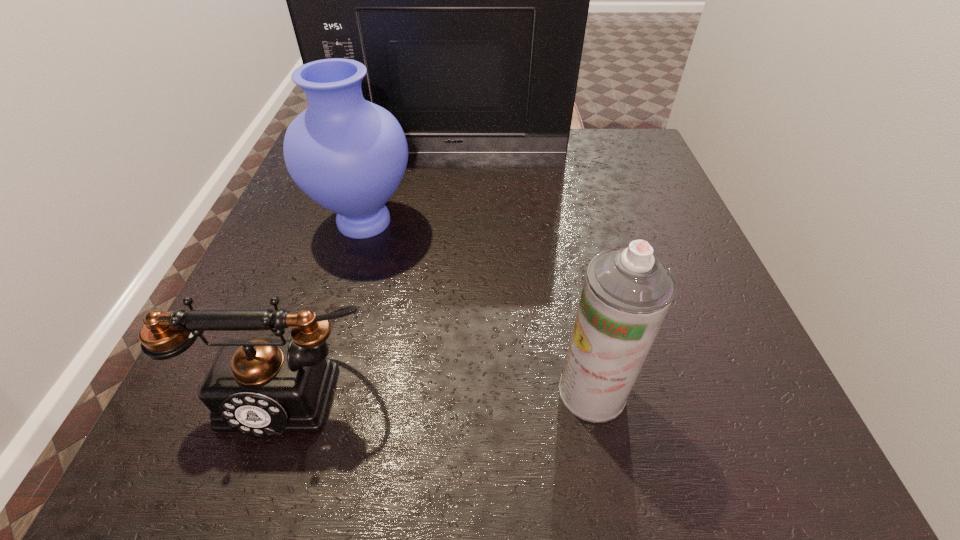
Locate an element on the screen. The image size is (960, 540). vacant space in between the microwave oven and the telephone is located at coordinates (368, 271).

Where is `object that is the second closest to the microwave oven`? The height and width of the screenshot is (540, 960). object that is the second closest to the microwave oven is located at coordinates pos(262,386).

In order to click on object that stands as the second closest to the vase in this screenshot , I will do `click(262, 386)`.

Where is `blank area in the image that satisfies the following two spatial constraints: 1. on the front of the aerosol can at the rotary dial; 2. on the right side of the shortest object`? blank area in the image that satisfies the following two spatial constraints: 1. on the front of the aerosol can at the rotary dial; 2. on the right side of the shortest object is located at coordinates (287, 392).

Where is `vacant region that satisfies the following two spatial constraints: 1. on the front panel of the aerosol can; 2. on the left side of the farthest object`? vacant region that satisfies the following two spatial constraints: 1. on the front panel of the aerosol can; 2. on the left side of the farthest object is located at coordinates (423, 392).